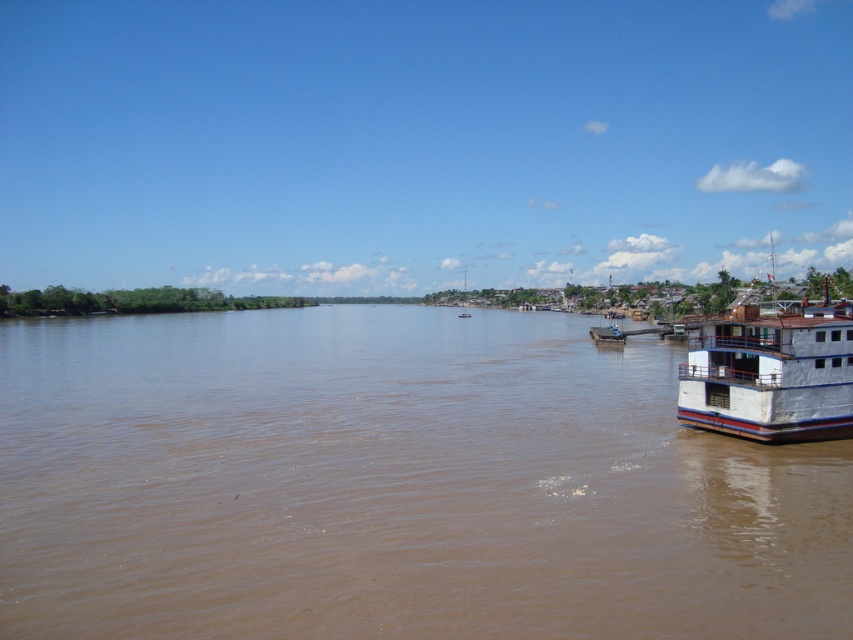
Question: Considering the real-world distances, which object is closest to the white painted wood boat at right?

Choices:
 (A) brown muddy water at center
 (B) white matte boat at center

Answer: (A)

Question: Estimate the real-world distances between objects in this image. Which object is farther from the white matte boat at center?

Choices:
 (A) white painted wood boat at right
 (B) white plastic boat at center

Answer: (A)

Question: Is brown muddy water at center in front of white matte boat at center?

Choices:
 (A) no
 (B) yes

Answer: (B)

Question: Is white painted wood boat at right wider than white plastic boat at center?

Choices:
 (A) no
 (B) yes

Answer: (B)

Question: Which point is closer to the camera?

Choices:
 (A) brown muddy water at center
 (B) white painted wood boat at right

Answer: (A)

Question: Is brown muddy water at center bigger than white painted wood boat at right?

Choices:
 (A) yes
 (B) no

Answer: (A)